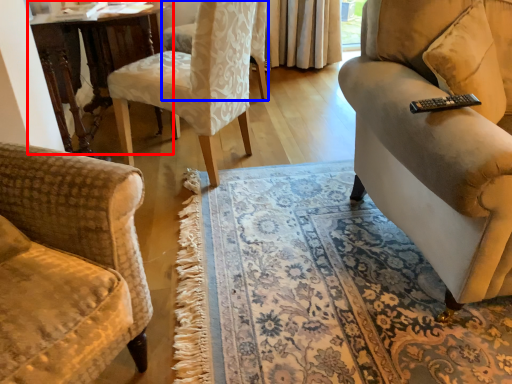
Question: Which object is further to the camera taking this photo, table (highlighted by a red box) or chair (highlighted by a blue box)?

Choices:
 (A) table
 (B) chair

Answer: (B)